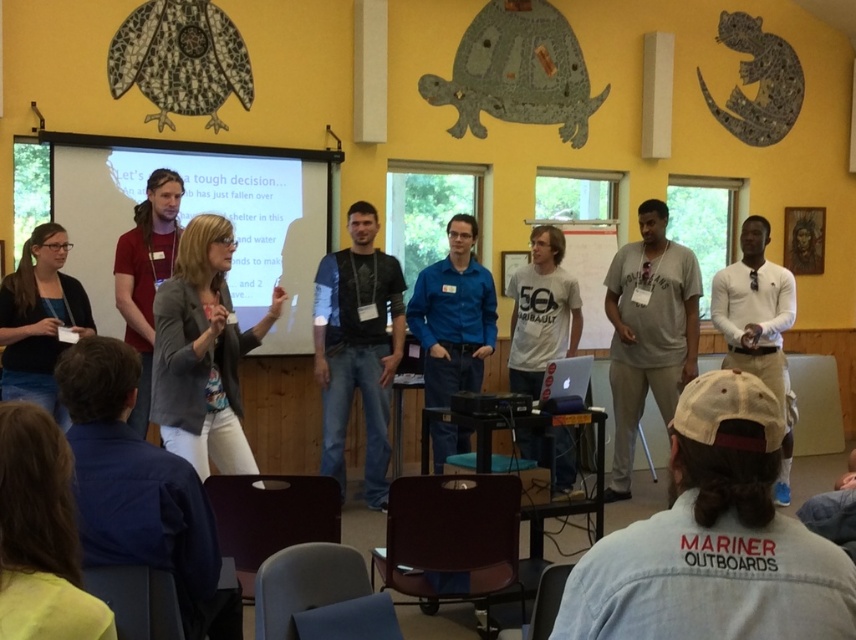
Question: Observing the image, what is the correct spatial positioning of white cotton cap at lower center in reference to white paper at center?

Choices:
 (A) below
 (B) above

Answer: (A)

Question: Which object appears farthest from the camera in this image?

Choices:
 (A) silver metallic laptop at center
 (B) black matte shirt at center
 (C) gray fabric jacket at center

Answer: (B)

Question: Does gray fabric jacket at center come behind blue shirt at center?

Choices:
 (A) no
 (B) yes

Answer: (A)

Question: Which object appears farthest from the camera in this image?

Choices:
 (A) matte gray sweater at lower left
 (B) black matte shirt at center
 (C) silver metallic laptop at center

Answer: (B)

Question: Which point is closer to the camera taking this photo?

Choices:
 (A) 551,349
 (B) 169,182
 (C) 597,291

Answer: (B)

Question: Can you confirm if black matte shirt at center is smaller than silver metallic laptop at center?

Choices:
 (A) no
 (B) yes

Answer: (A)